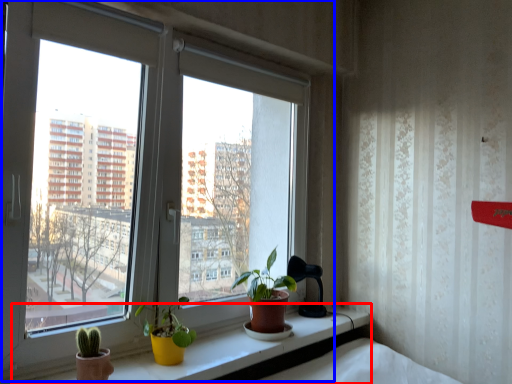
Question: Which of the following is the closest to the observer, window sill (highlighted by a red box) or window (highlighted by a blue box)?

Choices:
 (A) window sill
 (B) window

Answer: (A)